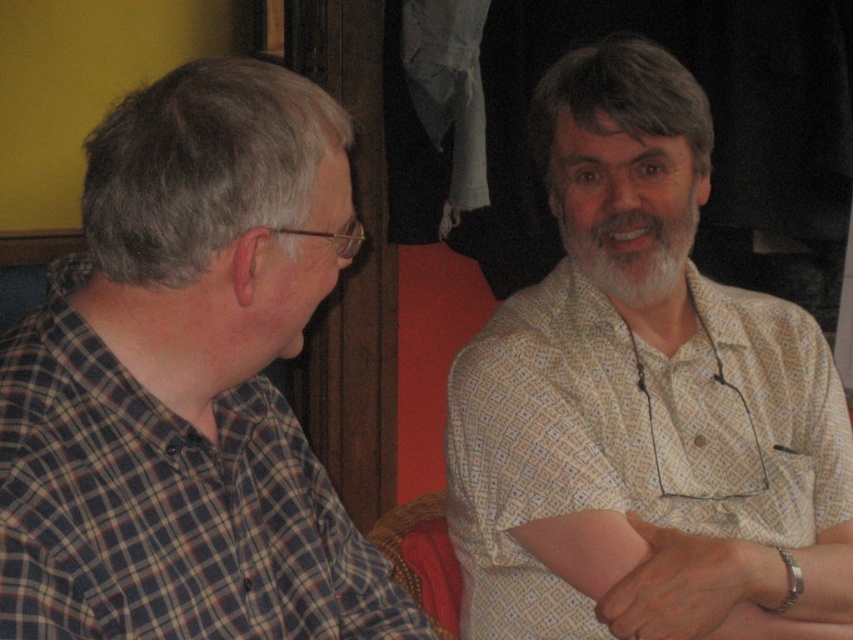
Does point (286, 522) come behind point (645, 221)?

No, it is not.

Is plaid shirt at left to the left of whitehairbeard at center from the viewer's perspective?

Correct, you'll find plaid shirt at left to the left of whitehairbeard at center.

Between point (94, 326) and point (628, 285), which one is positioned behind?

The point (628, 285) is behind.

Where is `plaid shirt at left`? This screenshot has height=640, width=853. plaid shirt at left is located at coordinates (187, 384).

Is white dotted shirt at upper right below whitehairbeard at center?

Yes, white dotted shirt at upper right is below whitehairbeard at center.

Is white dotted shirt at upper right taller than whitehairbeard at center?

Yes, white dotted shirt at upper right is taller than whitehairbeard at center.

Is point (579, 380) in front of point (689, 211)?

That is True.

Find the location of a particular element. The image size is (853, 640). white dotted shirt at upper right is located at coordinates (643, 403).

Which is more to the right, plaid shirt at left or white dotted shirt at upper right?

Positioned to the right is white dotted shirt at upper right.

Is plaid shirt at left wider than white dotted shirt at upper right?

In fact, plaid shirt at left might be narrower than white dotted shirt at upper right.

The image size is (853, 640). Identify the location of plaid shirt at left. (187, 384).